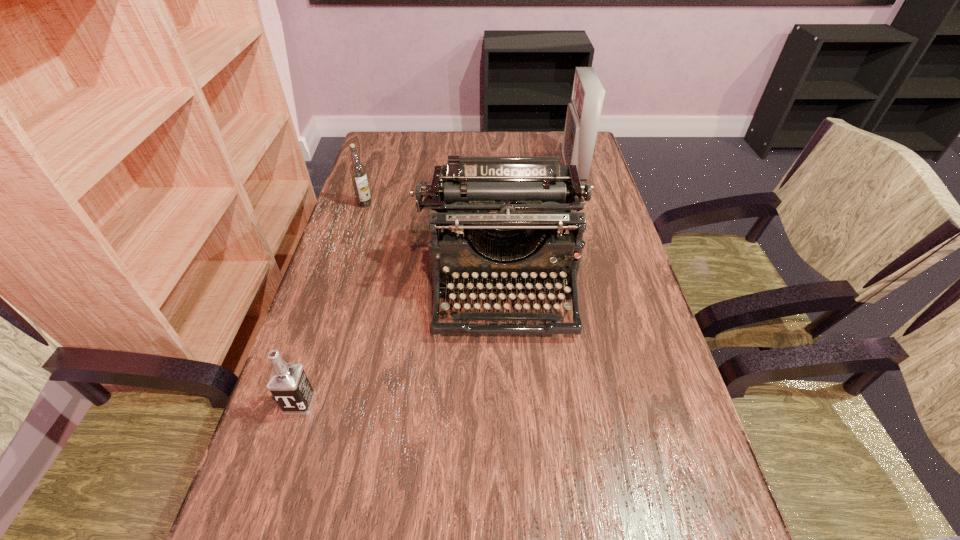
At what (x,y) coordinates should I click in order to perform the action: click on free space that satisfies the following two spatial constraints: 1. on the front-facing side of the first-aid kit; 2. on the typing side of the third object from left to right. Please return your answer as a coordinate pair (x, y). The width and height of the screenshot is (960, 540). Looking at the image, I should click on (607, 285).

Locate an element on the screen. The image size is (960, 540). free point that satisfies the following two spatial constraints: 1. on the front-facing side of the rightmost object; 2. on the front label of the shorter vodka is located at coordinates click(640, 403).

Locate an element on the screen. vacant area in the image that satisfies the following two spatial constraints: 1. on the front-facing side of the first-aid kit; 2. on the typing side of the second object from right to left is located at coordinates (607, 285).

The height and width of the screenshot is (540, 960). In order to click on free spot that satisfies the following two spatial constraints: 1. on the front-facing side of the first-aid kit; 2. on the front label of the shorter vodka in this screenshot , I will do `click(640, 403)`.

You are a GUI agent. You are given a task and a screenshot of the screen. Output one action in this format:
    pyautogui.click(x=<x>, y=<y>)
    Task: Click on the free space that satisfies the following two spatial constraints: 1. on the front-facing side of the rightmost object; 2. on the label of the third tallest object
    The width and height of the screenshot is (960, 540).
    Given the screenshot: What is the action you would take?
    pyautogui.click(x=584, y=204)